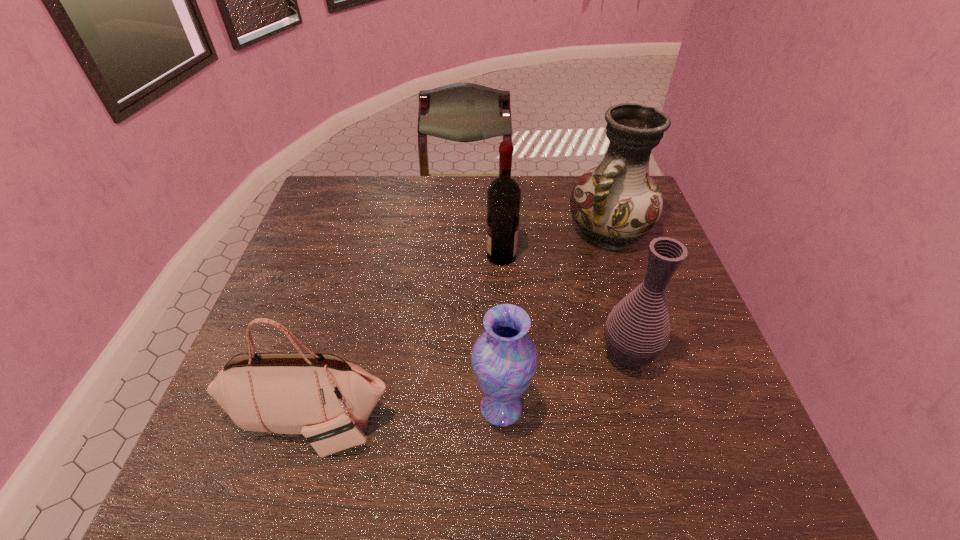
I want to click on free space between the alcohol and the third farthest object, so click(x=564, y=306).

Where is `object that is the third closest one to the alcohol`? Image resolution: width=960 pixels, height=540 pixels. object that is the third closest one to the alcohol is located at coordinates (504, 358).

Identify the location of the fourth closest object to the handbag. Image resolution: width=960 pixels, height=540 pixels. (617, 202).

Locate an element on the screen. This screenshot has width=960, height=540. vase that can be found as the third closest to the alcohol is located at coordinates (504, 358).

Choose which vase is the third nearest neighbor to the alcohol. Please provide its 2D coordinates. Your answer should be formatted as a tuple, i.e. [(x, y)], where the tuple contains the x and y coordinates of a point satisfying the conditions above.

[(504, 358)]

Where is `vacant region that satisfies the following two spatial constraints: 1. on the front and back of the alcohol; 2. on the front side of the leftmost vase`? This screenshot has width=960, height=540. vacant region that satisfies the following two spatial constraints: 1. on the front and back of the alcohol; 2. on the front side of the leftmost vase is located at coordinates (509, 407).

Where is `vacant space that satisfies the following two spatial constraints: 1. on the back side of the nearest vase; 2. on the right side of the farthest vase`? This screenshot has height=540, width=960. vacant space that satisfies the following two spatial constraints: 1. on the back side of the nearest vase; 2. on the right side of the farthest vase is located at coordinates (494, 231).